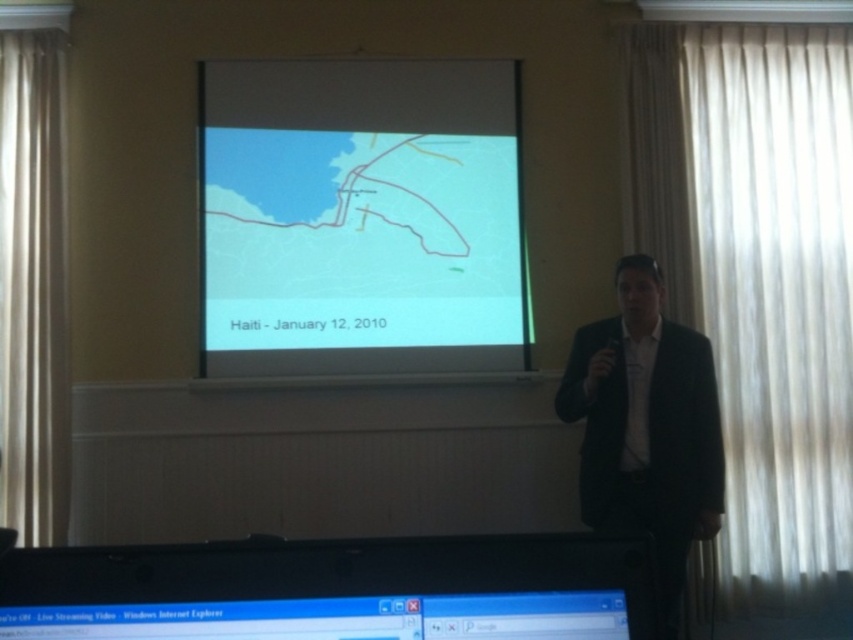
You are an attendee in the presentation and need to take a photo of both the matte map at center and the black plastic monitor at lower center. Which object should you focus on first if you want to capture both in a single frame without moving your camera?

The matte map at center is taller than the black plastic monitor at lower center, so you should focus on the matte map at center first as it occupies more vertical space, ensuring both objects fit within the frame.

You are an attendee in the presentation hall and need to locate the black plastic monitor at lower center. Based on its coordinates, where would you look in the room?

The black plastic monitor at lower center is located at coordinates point (334, 589), which would be near the bottom right corner of the room.